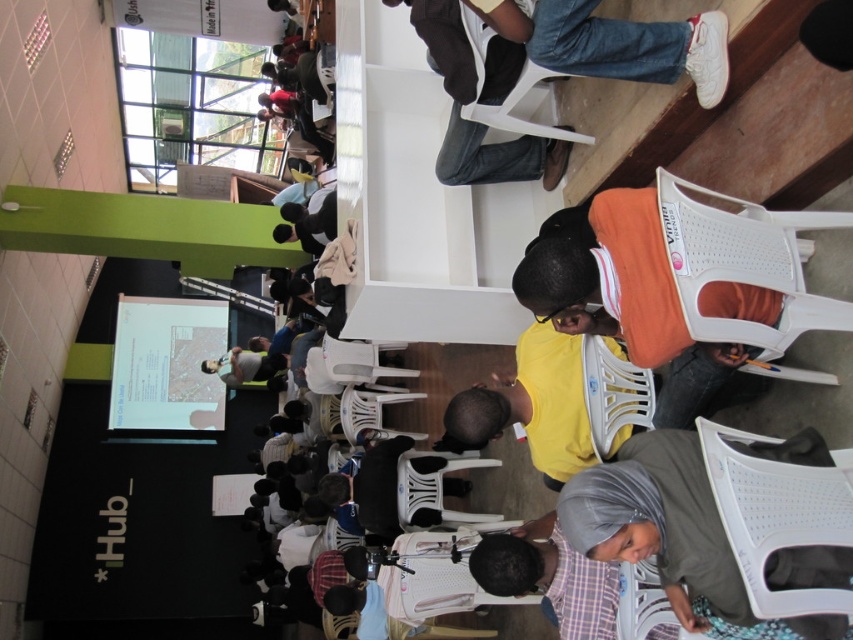
You are standing at the center of the room and need to sit down. There is a white mesh chair at lower right. Can you walk directly towards it without needing to move around any obstacles?

Yes, you can walk directly towards the white mesh chair at lower right because its position at point (776, 515) indicates it is in an open area with no obstacles blocking the path from the center of the room.

Consider the image. You are sitting in the white plastic chair at upper center and want to move to the front of the room to ask a question. Is the white mesh chair at lower right blocking your path?

The white mesh chair at lower right is in front of the white plastic chair at upper center, so it is blocking your path to the front of the room.